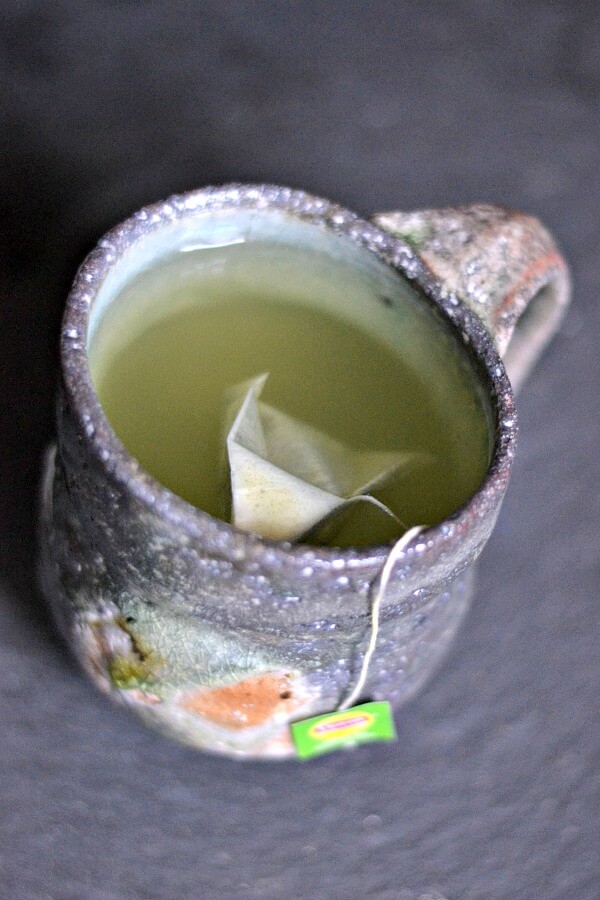
Where is `handle`? This screenshot has height=900, width=600. handle is located at coordinates (491, 307).